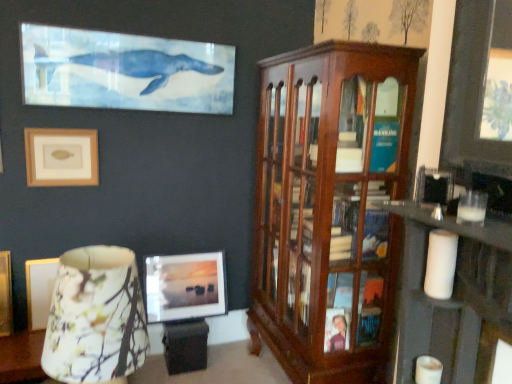
Question: Is matte glass picture frame at center, arranged as the 2th picture frame when viewed from the front, wider than floral fabric lampshade at lower left?

Choices:
 (A) no
 (B) yes

Answer: (A)

Question: Does matte glass picture frame at center, marked as the 1th picture frame in a right-to-left arrangement, have a lesser height compared to floral fabric lampshade at lower left?

Choices:
 (A) no
 (B) yes

Answer: (B)

Question: Can you confirm if matte glass picture frame at center, marked as the 1th picture frame in a right-to-left arrangement, is positioned to the left of floral fabric lampshade at lower left?

Choices:
 (A) yes
 (B) no

Answer: (B)

Question: Is matte glass picture frame at center, marked as the 1th picture frame in a right-to-left arrangement, located outside floral fabric lampshade at lower left?

Choices:
 (A) no
 (B) yes

Answer: (B)

Question: Can you confirm if matte glass picture frame at center, arranged as the first picture frame when ordered from the bottom, is thinner than floral fabric lampshade at lower left?

Choices:
 (A) no
 (B) yes

Answer: (B)

Question: In the image, is mahogany wood cabinet at right on the left side or the right side of white matte candle at lower right, arranged as the second candle when viewed from the top?

Choices:
 (A) left
 (B) right

Answer: (A)

Question: From a real-world perspective, is mahogany wood cabinet at right above or below white matte candle at lower right, arranged as the second candle when viewed from the top?

Choices:
 (A) above
 (B) below

Answer: (A)

Question: In terms of size, does mahogany wood cabinet at right appear bigger or smaller than white matte candle at lower right, arranged as the second candle when viewed from the top?

Choices:
 (A) small
 (B) big

Answer: (B)

Question: In terms of width, does mahogany wood cabinet at right look wider or thinner when compared to white matte candle at lower right, arranged as the second candle when viewed from the top?

Choices:
 (A) wide
 (B) thin

Answer: (A)

Question: Would you say matte glass picture frame at center, arranged as the 2th picture frame when viewed from the front, is inside or outside beige matte picture frame at upper left, which is the second picture frame from bottom to top?

Choices:
 (A) outside
 (B) inside

Answer: (A)

Question: Does point (162, 296) appear closer or farther from the camera than point (74, 175)?

Choices:
 (A) closer
 (B) farther

Answer: (B)

Question: Looking at the image, does matte glass picture frame at center, which ranks as the second picture frame in top-to-bottom order, seem bigger or smaller compared to beige matte picture frame at upper left, which is the second picture frame from bottom to top?

Choices:
 (A) big
 (B) small

Answer: (A)

Question: From the image's perspective, relative to beige matte picture frame at upper left, the first picture frame when ordered from front to back, is matte glass picture frame at center, arranged as the first picture frame when ordered from the bottom, above or below?

Choices:
 (A) above
 (B) below

Answer: (B)

Question: Would you say white matte candle at lower right, which is the first candle from bottom to top, is to the left or to the right of beige matte picture frame at upper left, acting as the second picture frame starting from the right, in the picture?

Choices:
 (A) right
 (B) left

Answer: (A)

Question: Is white matte candle at lower right, which is the first candle from bottom to top, inside or outside of beige matte picture frame at upper left, placed as the 2th picture frame when sorted from back to front?

Choices:
 (A) inside
 (B) outside

Answer: (B)